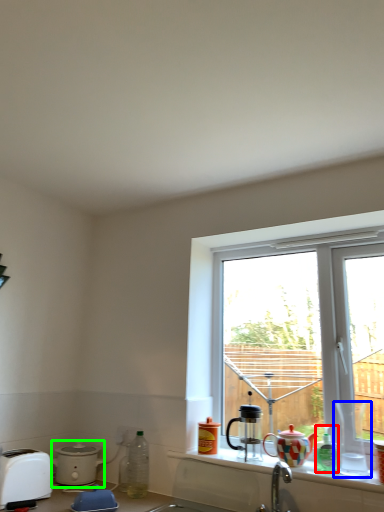
Question: Estimate the real-world distances between objects in this image. Which object is closer to bottle (highlighted by a red box), coffee cup (highlighted by a blue box) or kitchen appliance (highlighted by a green box)?

Choices:
 (A) coffee cup
 (B) kitchen appliance

Answer: (A)